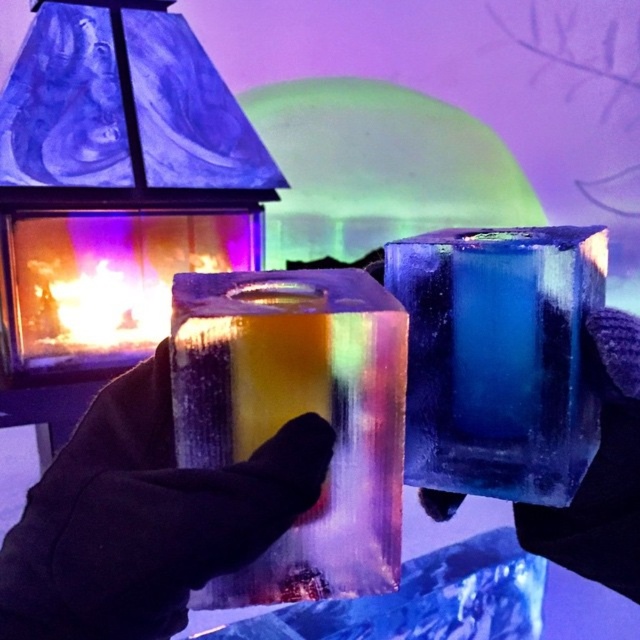
You are an ice sculptor holding two ice cubes in your hands. You notice that one is a translucent rainbow ice cube at center and the other is a translucent ice cube at center. Which one is closer to your eyes?

The translucent ice cube at center is closer to your eyes because the translucent rainbow ice cube at center is positioned behind it.

You are an architect designing a new ice hotel room. You need to place a heater in the room such that it is as far away as possible from the translucent ice cube at center to prevent melting. Where should you place the heater?

The heater should be placed as far away as possible from the translucent ice cube at center. Since the ice cube is at point (115, 186), the optimal position would be the point furthest from these coordinates within the room.

You are an ice sculptor holding two ice cubes in your hands. You notice that one is a translucent ice cube at center and the other is a translucent rainbow ice cube at center. Which one is located to the left?

The translucent ice cube at center is positioned on the left side of the translucent rainbow ice cube at center, so the translucent ice cube at center is the one located to the left.